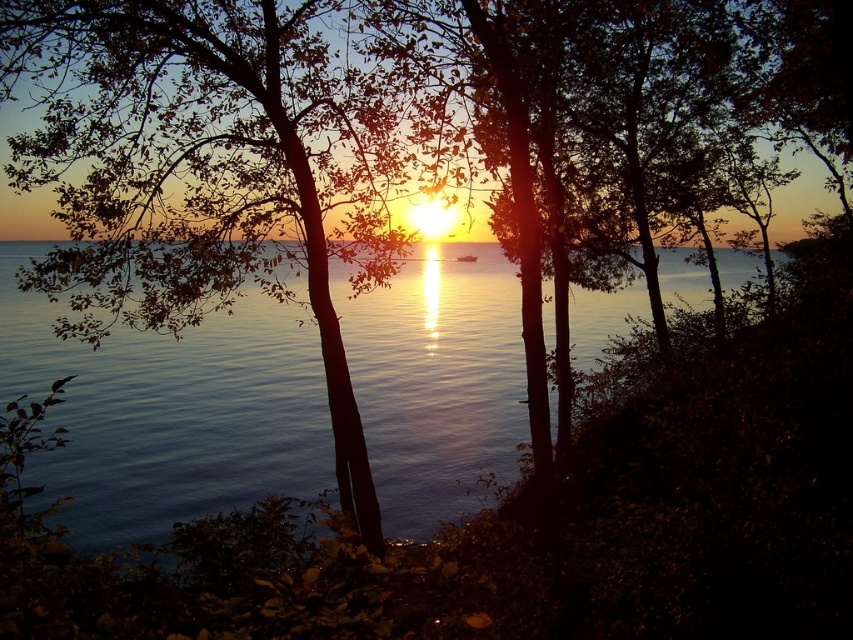
How distant is green leafy tree at center from glistening blue water at center?

green leafy tree at center and glistening blue water at center are 9.70 meters apart.

Is point (143, 282) farther from camera compared to point (186, 340)?

No, it is not.

Where is `green leafy tree at center`? Image resolution: width=853 pixels, height=640 pixels. green leafy tree at center is located at coordinates (221, 168).